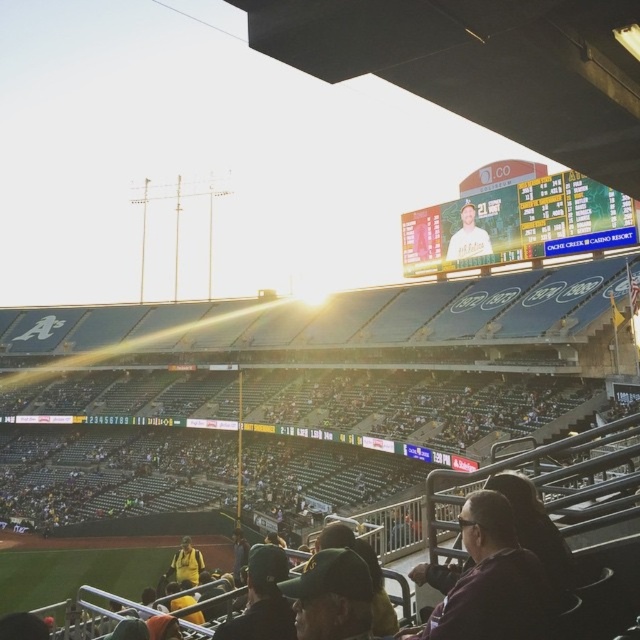
Question: Is green plastic scoreboard at upper center to the right of white matte shirt at upper center from the viewer's perspective?

Choices:
 (A) yes
 (B) no

Answer: (A)

Question: Estimate the real-world distances between objects in this image. Which object is farther from the purple fabric jacket at lower right?

Choices:
 (A) green plastic scoreboard at upper center
 (B) white matte shirt at upper center

Answer: (B)

Question: Where is green plastic scoreboard at upper center located in relation to purple fabric jacket at lower right in the image?

Choices:
 (A) below
 (B) above

Answer: (B)

Question: Can you confirm if green plastic scoreboard at upper center is positioned to the right of white matte shirt at upper center?

Choices:
 (A) no
 (B) yes

Answer: (B)

Question: Which point appears closest to the camera in this image?

Choices:
 (A) (540, 620)
 (B) (486, 246)

Answer: (A)

Question: Which object is closer to the camera taking this photo?

Choices:
 (A) purple fabric jacket at lower right
 (B) yellow jersey at lower center
 (C) green plastic scoreboard at upper center

Answer: (A)